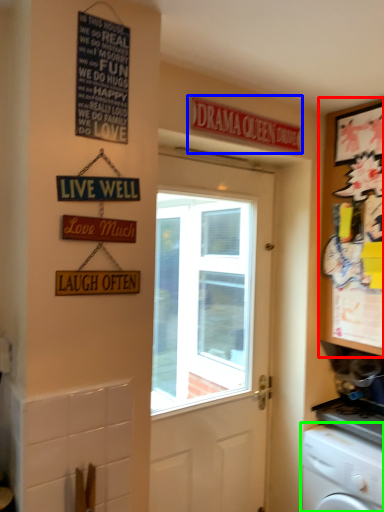
Question: Considering the real-world distances, which object is closest to cabinetry (highlighted by a red box)? sign (highlighted by a blue box) or washing machine (highlighted by a green box).

Choices:
 (A) sign
 (B) washing machine

Answer: (A)